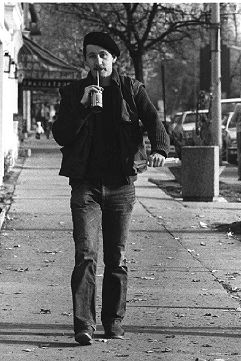
In order to click on cup in this screenshot , I will do `click(93, 101)`.